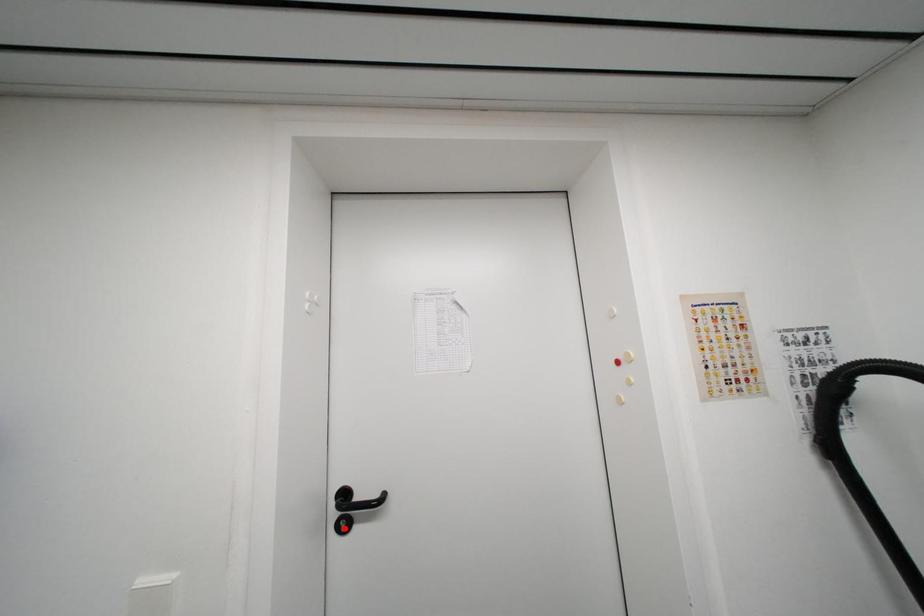
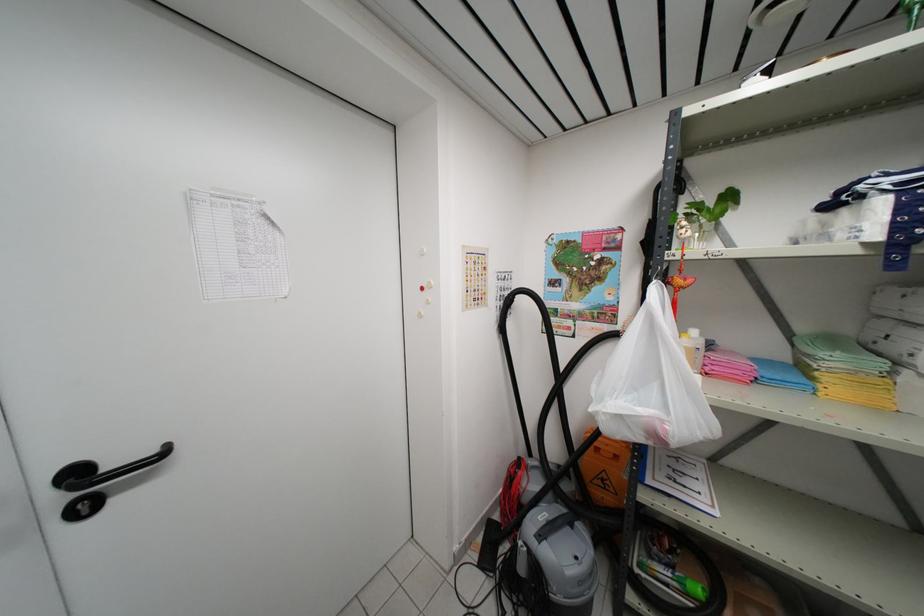
In the second image, find the point that corresponds to the highlighted location in the first image.

(83, 512)